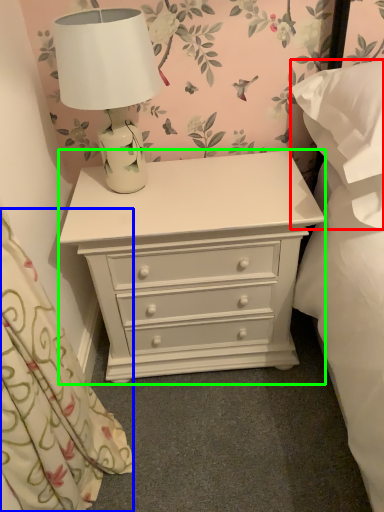
Question: Which object is the closest to the pillow (highlighted by a red box)? Choose among these: curtain (highlighted by a blue box) or chest of drawers (highlighted by a green box).

Choices:
 (A) curtain
 (B) chest of drawers

Answer: (B)